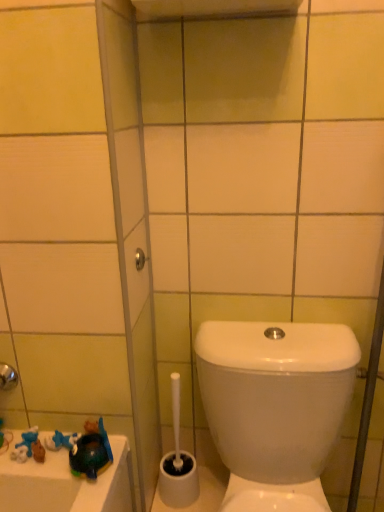
Describe the element at coordinates (91, 452) in the screenshot. I see `shiny blue plastic toy at lower left` at that location.

At what (x,y) coordinates should I click in order to perform the action: click on white plastic toilet brush at lower center. Please return your answer as a coordinate pair (x, y). This screenshot has width=384, height=512. Looking at the image, I should click on (178, 463).

Locate an element on the screen. The image size is (384, 512). matte silver showerhead at upper center is located at coordinates pyautogui.click(x=140, y=259).

Find the location of a particular element. This screenshot has height=512, width=384. white glossy toilet at lower right is located at coordinates (275, 395).

The image size is (384, 512). I want to click on shiny blue plastic toy at lower left, so click(x=91, y=452).

Does matte silver showerhead at upper center touch white glossy toilet at lower right?

No, matte silver showerhead at upper center is not in contact with white glossy toilet at lower right.

Which is more to the right, matte silver showerhead at upper center or white glossy toilet at lower right?

From the viewer's perspective, white glossy toilet at lower right appears more on the right side.

How many degrees apart are the facing directions of matte silver showerhead at upper center and white glossy toilet at lower right?

They differ by 86.7 degrees in their facing directions.

From the image's perspective, is white plastic toilet brush at lower center beneath shiny blue plastic toy at lower left?

Yes, from the image's perspective, white plastic toilet brush at lower center is below shiny blue plastic toy at lower left.

Is white plastic toilet brush at lower center positioned beyond the bounds of shiny blue plastic toy at lower left?

Yes, white plastic toilet brush at lower center is not within shiny blue plastic toy at lower left.

How far apart are white plastic toilet brush at lower center and shiny blue plastic toy at lower left?

white plastic toilet brush at lower center and shiny blue plastic toy at lower left are 10.89 inches apart from each other.

Can you tell me how much white plastic toilet brush at lower center and shiny blue plastic toy at lower left differ in facing direction?

They differ by 1.19 degrees in their facing directions.

From their relative heights in the image, would you say matte silver showerhead at upper center is taller or shorter than white plastic toilet brush at lower center?

Considering their sizes, matte silver showerhead at upper center has less height than white plastic toilet brush at lower center.

Is matte silver showerhead at upper center not close to white plastic toilet brush at lower center?

matte silver showerhead at upper center is near white plastic toilet brush at lower center, not far away.

Could you tell me if matte silver showerhead at upper center is turned towards white plastic toilet brush at lower center?

No.

Between matte silver showerhead at upper center and white plastic toilet brush at lower center, which one has larger size?

white plastic toilet brush at lower center is bigger.

Is shiny blue plastic toy at lower left far from white glossy toilet at lower right?

No, shiny blue plastic toy at lower left is in close proximity to white glossy toilet at lower right.

Is shiny blue plastic toy at lower left aimed at white glossy toilet at lower right?

No, shiny blue plastic toy at lower left does not turn towards white glossy toilet at lower right.

How far apart are shiny blue plastic toy at lower left and white glossy toilet at lower right?

shiny blue plastic toy at lower left and white glossy toilet at lower right are 15.23 inches apart.

Which is farther, (90, 442) or (231, 331)?

The point (231, 331) is farther from the camera.

Is there a large distance between white glossy toilet at lower right and white plastic toilet brush at lower center?

No, white glossy toilet at lower right is not far away from white plastic toilet brush at lower center.

How many degrees apart are the facing directions of white glossy toilet at lower right and white plastic toilet brush at lower center?

white glossy toilet at lower right and white plastic toilet brush at lower center are facing 4.52e-05 degrees away from each other.

Which is correct: white glossy toilet at lower right is inside white plastic toilet brush at lower center, or outside of it?

The correct answer is: outside.

I want to click on brush on the left of white glossy toilet at lower right, so click(178, 463).

Would you consider white glossy toilet at lower right to be distant from matte silver showerhead at upper center?

No, there isn't a large distance between white glossy toilet at lower right and matte silver showerhead at upper center.

Between white glossy toilet at lower right and matte silver showerhead at upper center, which one has smaller width?

matte silver showerhead at upper center is thinner.

How far apart are white glossy toilet at lower right and matte silver showerhead at upper center?

The distance of white glossy toilet at lower right from matte silver showerhead at upper center is 17.31 inches.

Can matte silver showerhead at upper center be found inside white glossy toilet at lower right?

No, white glossy toilet at lower right does not contain matte silver showerhead at upper center.

Can you tell me how much matte silver showerhead at upper center and shiny blue plastic toy at lower left differ in facing direction?

The facing directions of matte silver showerhead at upper center and shiny blue plastic toy at lower left are 87.9 degrees apart.

From the picture: From a real-world perspective, between matte silver showerhead at upper center and shiny blue plastic toy at lower left, who is vertically higher?

matte silver showerhead at upper center.

Which of these two, matte silver showerhead at upper center or shiny blue plastic toy at lower left, is bigger?

shiny blue plastic toy at lower left.

Looking at this image, would you say shiny blue plastic toy at lower left is part of matte silver showerhead at upper center's contents?

Definitely not — shiny blue plastic toy at lower left is not inside matte silver showerhead at upper center.

Identify the location of shower behind the white glossy toilet at lower right. (140, 259).

Image resolution: width=384 pixels, height=512 pixels. Identify the location of brush below the shiny blue plastic toy at lower left (from the image's perspective). (178, 463).

From the image, which object appears to be nearer to shiny blue plastic toy at lower left, white plastic toilet brush at lower center or white glossy toilet at lower right?

white plastic toilet brush at lower center.

From the image, which object appears to be nearer to white glossy toilet at lower right, matte silver showerhead at upper center or shiny blue plastic toy at lower left?

The object closer to white glossy toilet at lower right is shiny blue plastic toy at lower left.

In the scene shown: When comparing their distances from white plastic toilet brush at lower center, does white glossy toilet at lower right or shiny blue plastic toy at lower left seem closer?

The object closer to white plastic toilet brush at lower center is white glossy toilet at lower right.

Considering their positions, is white glossy toilet at lower right positioned closer to matte silver showerhead at upper center than shiny blue plastic toy at lower left?

shiny blue plastic toy at lower left.

From the image, which object appears to be nearer to white glossy toilet at lower right, shiny blue plastic toy at lower left or matte silver showerhead at upper center?

shiny blue plastic toy at lower left is closer to white glossy toilet at lower right.

Estimate the real-world distances between objects in this image. Which object is closer to matte silver showerhead at upper center, white plastic toilet brush at lower center or shiny blue plastic toy at lower left?

shiny blue plastic toy at lower left is closer to matte silver showerhead at upper center.

Which object lies further to the anchor point white plastic toilet brush at lower center, matte silver showerhead at upper center or shiny blue plastic toy at lower left?

matte silver showerhead at upper center.

Which object lies nearer to the anchor point white plastic toilet brush at lower center, shiny blue plastic toy at lower left or matte silver showerhead at upper center?

shiny blue plastic toy at lower left is positioned closer to the anchor white plastic toilet brush at lower center.

What are the coordinates of `toy between matte silver showerhead at upper center and white plastic toilet brush at lower center in the up-down direction` in the screenshot? It's located at (91, 452).

This screenshot has height=512, width=384. Identify the location of toy between matte silver showerhead at upper center and white glossy toilet at lower right in the up-down direction. (91, 452).

You are a GUI agent. You are given a task and a screenshot of the screen. Output one action in this format:
    pyautogui.click(x=<x>, y=<y>)
    Task: Click on the brush that lies between matte silver showerhead at upper center and white glossy toilet at lower right from top to bottom
    This screenshot has height=512, width=384.
    Given the screenshot: What is the action you would take?
    pyautogui.click(x=178, y=463)

This screenshot has height=512, width=384. I want to click on toy between white glossy toilet at lower right and white plastic toilet brush at lower center in the front-back direction, so click(91, 452).